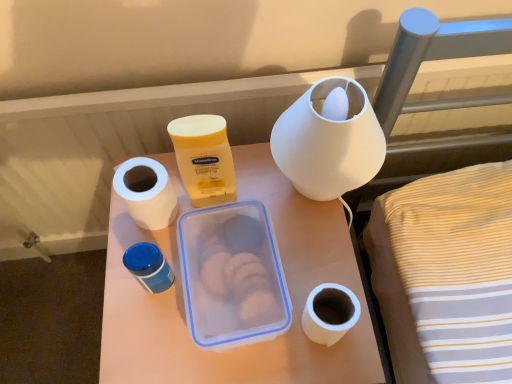
You are a GUI agent. You are given a task and a screenshot of the screen. Output one action in this format:
    pyautogui.click(x=<x>, y=<y>)
    Task: Click on the unoccupied region to the right of blue plastic container at center-left, which appears as the 2th pottery when viewed from the right
    
    Given the screenshot: What is the action you would take?
    pyautogui.click(x=263, y=256)